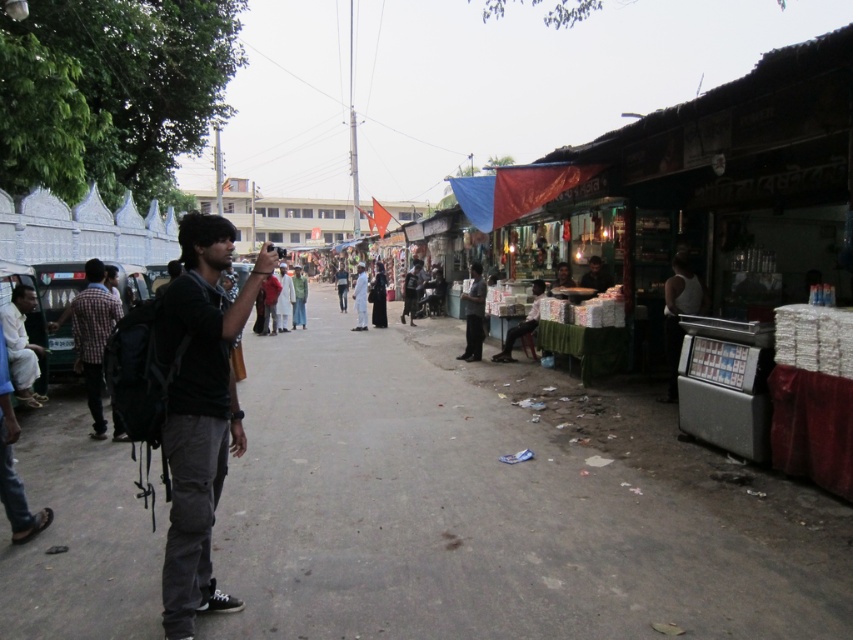
Question: Can you confirm if black cotton shirt at center is smaller than dark gray pants at center?

Choices:
 (A) yes
 (B) no

Answer: (B)

Question: Which object is closer to the camera taking this photo?

Choices:
 (A) dark gray asphalt at center
 (B) black cotton shirt at center
 (C) checkered fabric shirt at left
 (D) dark gray pants at center

Answer: (B)

Question: Estimate the real-world distances between objects in this image. Which object is farther from the dark gray pants at center?

Choices:
 (A) dark gray asphalt at center
 (B) black cotton shirt at center

Answer: (B)

Question: Among these points, which one is nearest to the camera?

Choices:
 (A) (467, 355)
 (B) (99, 285)
 (C) (200, 244)
 (D) (292, 378)

Answer: (C)

Question: Where is black cotton shirt at center located in relation to checkered fabric shirt at left in the image?

Choices:
 (A) left
 (B) right

Answer: (B)

Question: Is black cotton shirt at center below checkered fabric shirt at left?

Choices:
 (A) no
 (B) yes

Answer: (B)